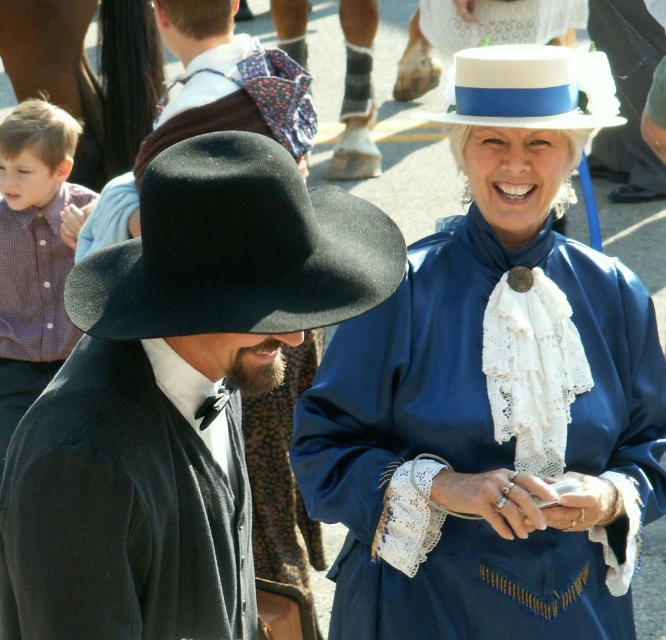
You are a photographer and want to capture a closeup of the plaid shirt at left. What coordinate should you focus on?

You should focus on point (33, 253) to capture a closeup of the plaid shirt at left.

You are a photographer trying to capture a closeup of both the plaid shirt at left and the black felt hat at upper left in the scene. Since you can only focus on one object at a time, which object should you choose to ensure the other is still in the background and recognizable?

The plaid shirt at left has a greater height compared to the black felt hat at upper left, so you should focus on the plaid shirt at left to ensure the smaller black felt hat at upper left remains in the background and still recognizable.

You are a costume designer assessing the height of the hats in the image. Which hat is taller between the black felt cowboy hat at left and the white felt dress hat at upper center?

The black felt cowboy hat at left is taller than the white felt dress hat at upper center.